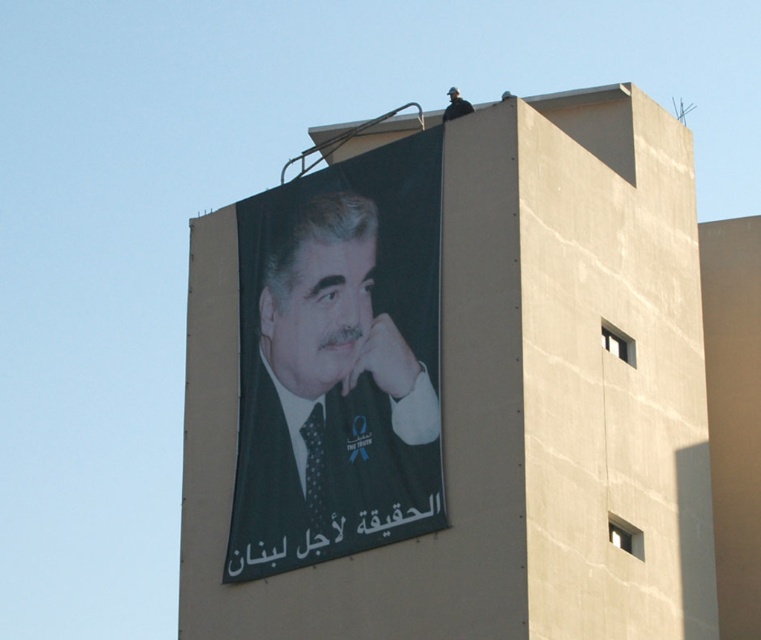
Question: Among these points, which one is nearest to the camera?

Choices:
 (A) (326, 339)
 (B) (253, 204)

Answer: (A)

Question: Considering the relative positions of dark green matte poster at upper center and matte black jaw at upper center in the image provided, where is dark green matte poster at upper center located with respect to matte black jaw at upper center?

Choices:
 (A) left
 (B) right

Answer: (A)

Question: In this image, where is dark green matte poster at upper center located relative to matte black jaw at upper center?

Choices:
 (A) above
 (B) below

Answer: (B)

Question: Is dark green matte poster at upper center wider than matte black jaw at upper center?

Choices:
 (A) yes
 (B) no

Answer: (A)